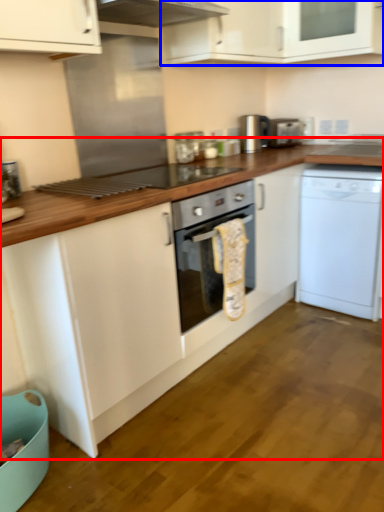
Question: Which of the following is the closest to the observer, countertop (highlighted by a red box) or cabinetry (highlighted by a blue box)?

Choices:
 (A) countertop
 (B) cabinetry

Answer: (A)